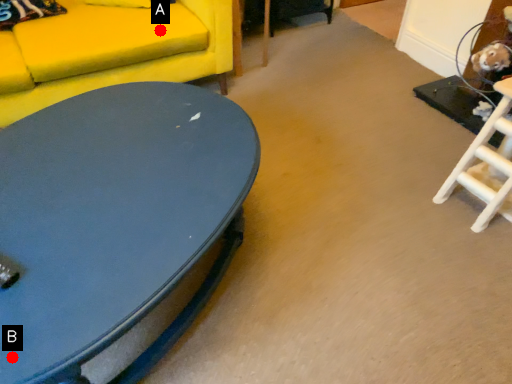
Question: Two points are circled on the image, labeled by A and B beside each circle. Which point appears farthest from the camera in this image?

Choices:
 (A) A is further
 (B) B is further

Answer: (A)